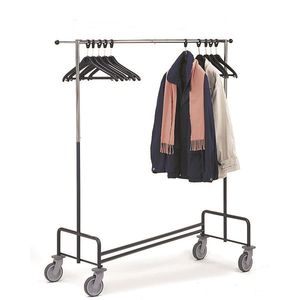
The image size is (300, 300). What are the coordinates of `empty hangers` in the screenshot? It's located at (87, 60), (93, 60), (99, 60), (106, 61), (113, 60), (207, 57), (212, 57), (218, 57).